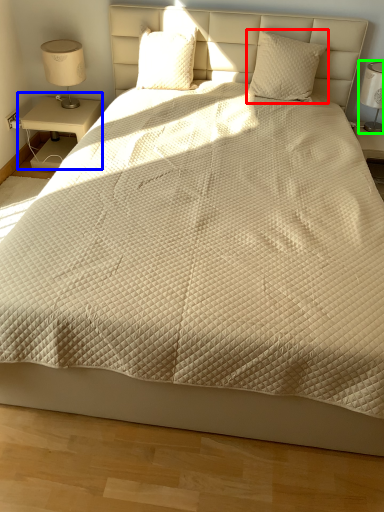
Question: Based on their relative distances, which object is farther from pillow (highlighted by a red box)? Choose from nightstand (highlighted by a blue box) and bedside lamp (highlighted by a green box).

Choices:
 (A) nightstand
 (B) bedside lamp

Answer: (A)